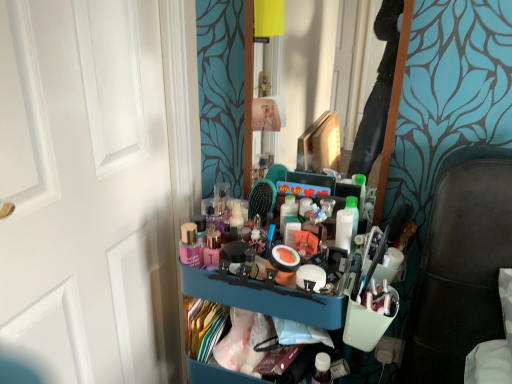
Question: Is clear glass mirror at center located outside blue plastic bookshelf at center?

Choices:
 (A) yes
 (B) no

Answer: (A)

Question: From a real-world perspective, is clear glass mirror at center physically below blue plastic bookshelf at center?

Choices:
 (A) yes
 (B) no

Answer: (B)

Question: Is clear glass mirror at center to the right of blue plastic bookshelf at center from the viewer's perspective?

Choices:
 (A) no
 (B) yes

Answer: (B)

Question: Would you say clear glass mirror at center is a long distance from blue plastic bookshelf at center?

Choices:
 (A) yes
 (B) no

Answer: (B)

Question: From the image's perspective, is clear glass mirror at center located beneath blue plastic bookshelf at center?

Choices:
 (A) no
 (B) yes

Answer: (A)

Question: From the image's perspective, is blue plastic tray at center located above or below blue plastic bookshelf at center?

Choices:
 (A) below
 (B) above

Answer: (B)

Question: Is blue plastic tray at center in front of or behind blue plastic bookshelf at center in the image?

Choices:
 (A) front
 (B) behind

Answer: (B)

Question: Is point (338, 337) positioned closer to the camera than point (254, 309)?

Choices:
 (A) closer
 (B) farther

Answer: (B)

Question: Looking at the image, does blue plastic tray at center seem bigger or smaller compared to blue plastic bookshelf at center?

Choices:
 (A) small
 (B) big

Answer: (A)

Question: Based on their sizes in the image, would you say blue plastic bookshelf at center is bigger or smaller than clear glass mirror at center?

Choices:
 (A) big
 (B) small

Answer: (A)

Question: Considering their positions, is blue plastic bookshelf at center located in front of or behind clear glass mirror at center?

Choices:
 (A) front
 (B) behind

Answer: (A)

Question: Is blue plastic bookshelf at center situated inside clear glass mirror at center or outside?

Choices:
 (A) outside
 (B) inside

Answer: (A)

Question: From the image's perspective, relative to clear glass mirror at center, is blue plastic bookshelf at center above or below?

Choices:
 (A) below
 (B) above

Answer: (A)

Question: Would you say blue plastic tray at center is to the left or to the right of clear glass mirror at center in the picture?

Choices:
 (A) right
 (B) left

Answer: (B)

Question: From the image's perspective, is blue plastic tray at center located above or below clear glass mirror at center?

Choices:
 (A) below
 (B) above

Answer: (A)